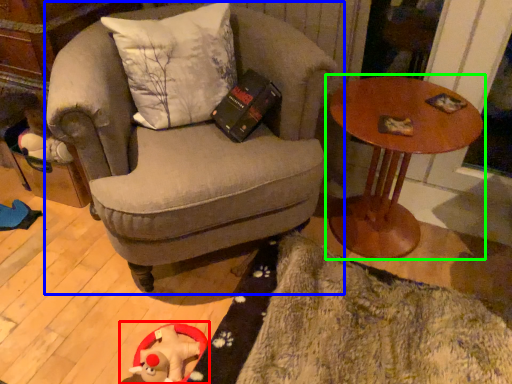
Question: Which is nearer to the toy (highlighted by a red box)? chair (highlighted by a blue box) or table (highlighted by a green box).

Choices:
 (A) chair
 (B) table

Answer: (A)